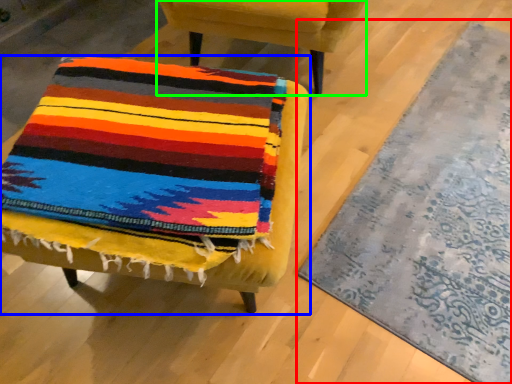
Question: Considering the real-world distances, which object is farthest from mat (highlighted by a red box)? chair (highlighted by a blue box) or chair (highlighted by a green box)?

Choices:
 (A) chair
 (B) chair

Answer: (B)